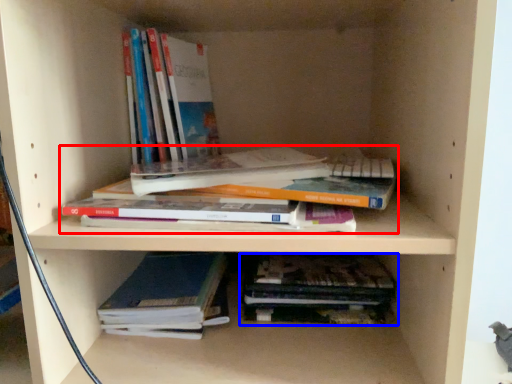
Question: Which of the following is the farthest to the observer, book (highlighted by a red box) or book (highlighted by a blue box)?

Choices:
 (A) book
 (B) book

Answer: (B)